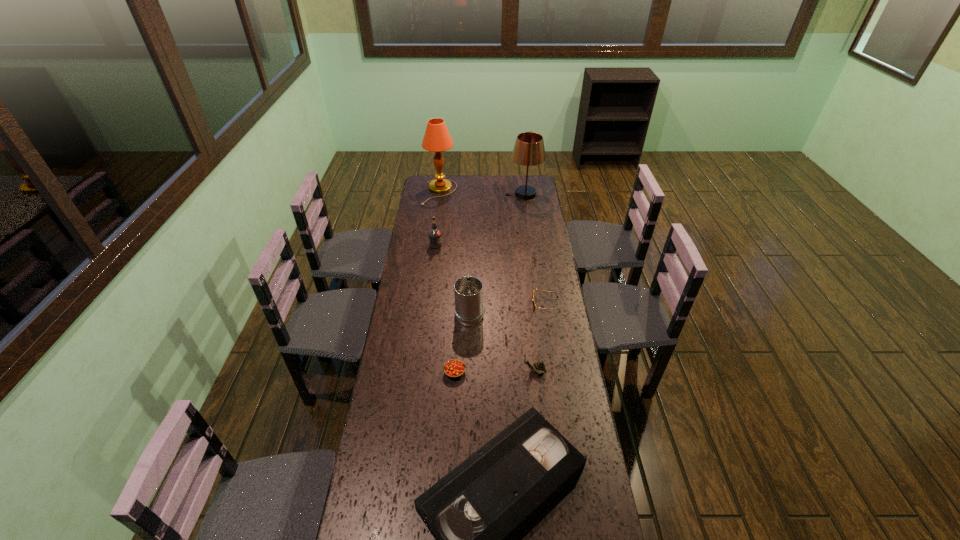
Locate an element on the screen. blank space located 0.140m on the front-facing side of the lampshade is located at coordinates (482, 194).

Identify the location of free location located on the front label of the vodka. This screenshot has height=540, width=960. (458, 245).

The height and width of the screenshot is (540, 960). Find the location of `vacant space located on the side of the mug with the handle`. vacant space located on the side of the mug with the handle is located at coordinates (471, 242).

This screenshot has width=960, height=540. Identify the location of free location located on the side of the mug with the handle. (470, 267).

Find the location of a particular element. The image size is (960, 540). free location located 0.090m on the side of the mug with the handle is located at coordinates point(469,282).

Locate an element on the screen. Image resolution: width=960 pixels, height=540 pixels. vacant space located 0.050m on the face of the snail is located at coordinates (509, 371).

Locate an element on the screen. The height and width of the screenshot is (540, 960). free region located 0.140m on the face of the snail is located at coordinates (486, 371).

I want to click on vacant point located 0.280m on the face of the snail, so click(448, 371).

Where is `vacant space situated on the front of the strawberry`? Image resolution: width=960 pixels, height=540 pixels. vacant space situated on the front of the strawberry is located at coordinates (453, 397).

Image resolution: width=960 pixels, height=540 pixels. Find the location of `vacant space located on the front-facing side of the sunglasses`. vacant space located on the front-facing side of the sunglasses is located at coordinates (450, 304).